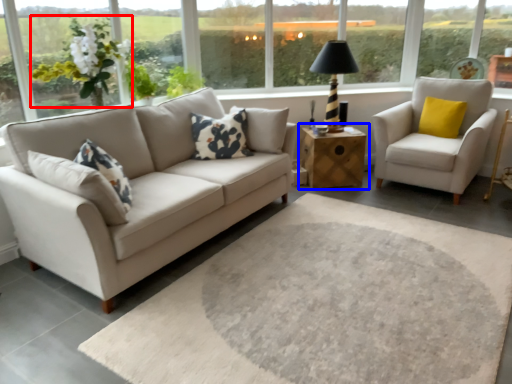
Question: Which of the following is the closest to the observer, flower (highlighted by a red box) or table (highlighted by a blue box)?

Choices:
 (A) flower
 (B) table

Answer: (A)